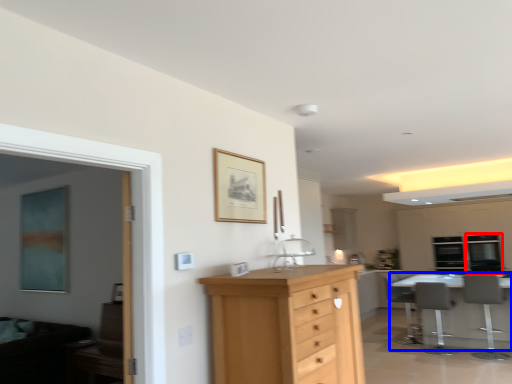
Question: Which of the following is the farthest to the observer, window (highlighted by a red box) or table (highlighted by a blue box)?

Choices:
 (A) window
 (B) table

Answer: (A)